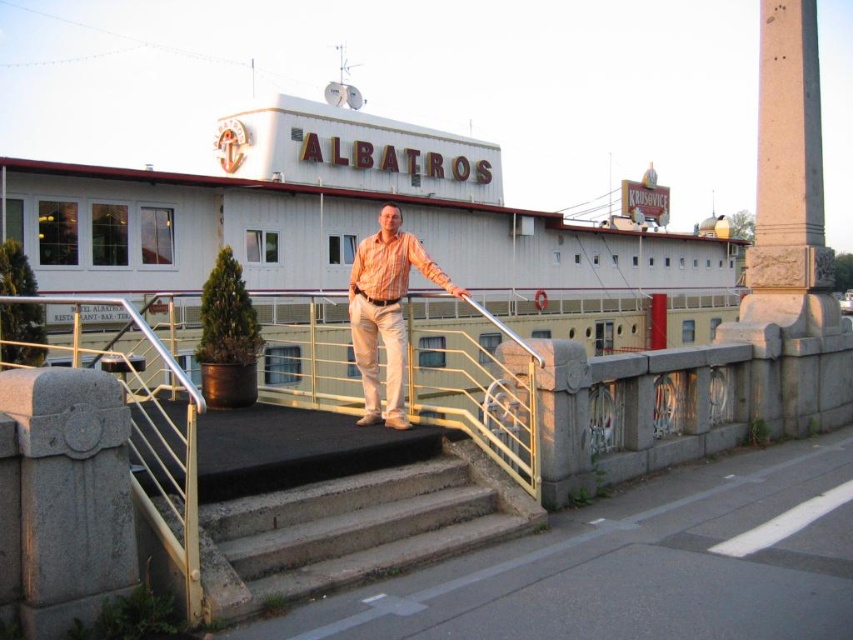
Which is below, concrete stairs at center or silver metallic railing at center?

Positioned lower is concrete stairs at center.

Which of these two, concrete stairs at center or silver metallic railing at center, stands shorter?

With less height is concrete stairs at center.

Which is behind, point (337, 496) or point (192, 612)?

The point (337, 496) is more distant.

At what (x,y) coordinates should I click in order to perform the action: click on concrete stairs at center. Please return your answer as a coordinate pair (x, y). Looking at the image, I should click on (355, 529).

Is silver metallic railing at center behind matte orange shirt at center?

That is False.

Image resolution: width=853 pixels, height=640 pixels. What do you see at coordinates (146, 428) in the screenshot? I see `silver metallic railing at center` at bounding box center [146, 428].

Who is more distant from viewer, (154, 509) or (399, 282)?

The point (399, 282) is more distant.

Where is `silver metallic railing at center`? This screenshot has height=640, width=853. silver metallic railing at center is located at coordinates (146, 428).

Is concrete stairs at center shorter than matte orange shirt at center?

Correct, concrete stairs at center is not as tall as matte orange shirt at center.

Which is in front, point (428, 513) or point (384, 252)?

Point (428, 513) is in front.

You are a GUI agent. You are given a task and a screenshot of the screen. Output one action in this format:
    pyautogui.click(x=<x>, y=<y>)
    Task: Click on the concrete stairs at center
    This screenshot has width=853, height=640.
    Given the screenshot: What is the action you would take?
    pyautogui.click(x=355, y=529)